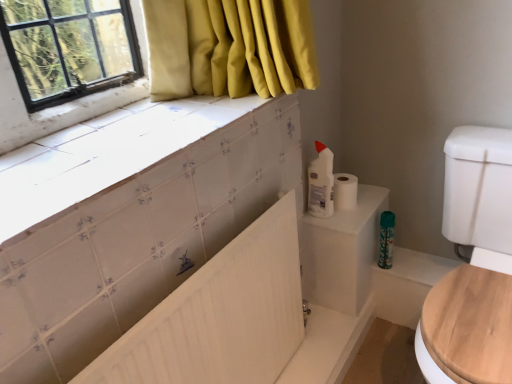
Question: Is white plastic bottle at upper right, the 1th cleaning product when ordered from left to right, to the left of white glossy tile at upper left from the viewer's perspective?

Choices:
 (A) yes
 (B) no

Answer: (B)

Question: Considering the relative sizes of white plastic bottle at upper right, the 1th cleaning product when ordered from left to right, and white glossy tile at upper left in the image provided, is white plastic bottle at upper right, the 1th cleaning product when ordered from left to right, taller than white glossy tile at upper left?

Choices:
 (A) yes
 (B) no

Answer: (A)

Question: Considering the relative sizes of white plastic bottle at upper right, the 1th cleaning product from the front, and white glossy tile at upper left in the image provided, is white plastic bottle at upper right, the 1th cleaning product from the front, wider than white glossy tile at upper left?

Choices:
 (A) yes
 (B) no

Answer: (B)

Question: Is white plastic bottle at upper right, the second cleaning product positioned from the back, bigger than white glossy tile at upper left?

Choices:
 (A) yes
 (B) no

Answer: (B)

Question: From a real-world perspective, is white plastic bottle at upper right, the 1th cleaning product when ordered from left to right, physically above white glossy tile at upper left?

Choices:
 (A) no
 (B) yes

Answer: (A)

Question: Looking at the image, does white matte toilet paper at upper right seem bigger or smaller compared to white matte radiator at center?

Choices:
 (A) small
 (B) big

Answer: (A)

Question: From the image's perspective, is white matte toilet paper at upper right located above or below white matte radiator at center?

Choices:
 (A) below
 (B) above

Answer: (B)

Question: Is white matte toilet paper at upper right inside the boundaries of white matte radiator at center, or outside?

Choices:
 (A) outside
 (B) inside

Answer: (A)

Question: Is white matte toilet paper at upper right wider or thinner than white matte radiator at center?

Choices:
 (A) thin
 (B) wide

Answer: (B)

Question: From a real-world perspective, is white matte toilet paper at upper right positioned above or below white plastic bottle at upper right, the 1th cleaning product from the front?

Choices:
 (A) above
 (B) below

Answer: (B)

Question: In terms of height, does white matte toilet paper at upper right look taller or shorter compared to white plastic bottle at upper right, the 1th cleaning product from the front?

Choices:
 (A) short
 (B) tall

Answer: (A)

Question: Based on their positions, is white matte toilet paper at upper right located to the left or right of white plastic bottle at upper right, which is counted as the 1th cleaning product, starting from the top?

Choices:
 (A) right
 (B) left

Answer: (A)

Question: Is white matte toilet paper at upper right wider or thinner than white plastic bottle at upper right, the second cleaning product positioned from the back?

Choices:
 (A) thin
 (B) wide

Answer: (B)

Question: Do you think white glossy tile at upper left is within white matte toilet paper at upper right, or outside of it?

Choices:
 (A) outside
 (B) inside

Answer: (A)

Question: Based on their positions, is white glossy tile at upper left located to the left or right of white matte toilet paper at upper right?

Choices:
 (A) left
 (B) right

Answer: (A)